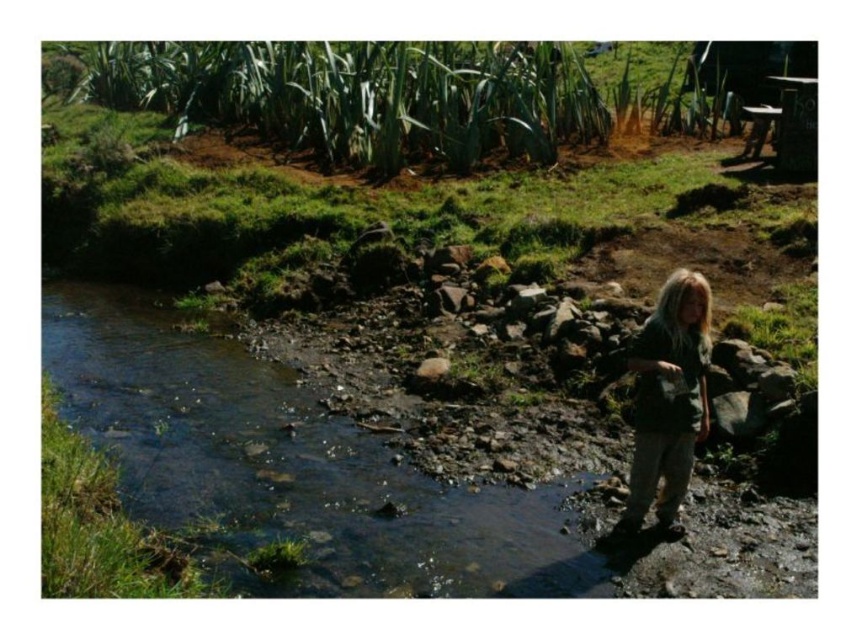
Who is taller, clear water at stream center or green fabric shirt at lower right?

Standing taller between the two is green fabric shirt at lower right.

Between point (289, 442) and point (704, 340), which one is positioned behind?

Point (289, 442)

Find the location of a particular element. The image size is (862, 640). clear water at stream center is located at coordinates (290, 464).

You are a GUI agent. You are given a task and a screenshot of the screen. Output one action in this format:
    pyautogui.click(x=<x>, y=<y>)
    Task: Click on the clear water at stream center
    This screenshot has width=862, height=640.
    Given the screenshot: What is the action you would take?
    pyautogui.click(x=290, y=464)